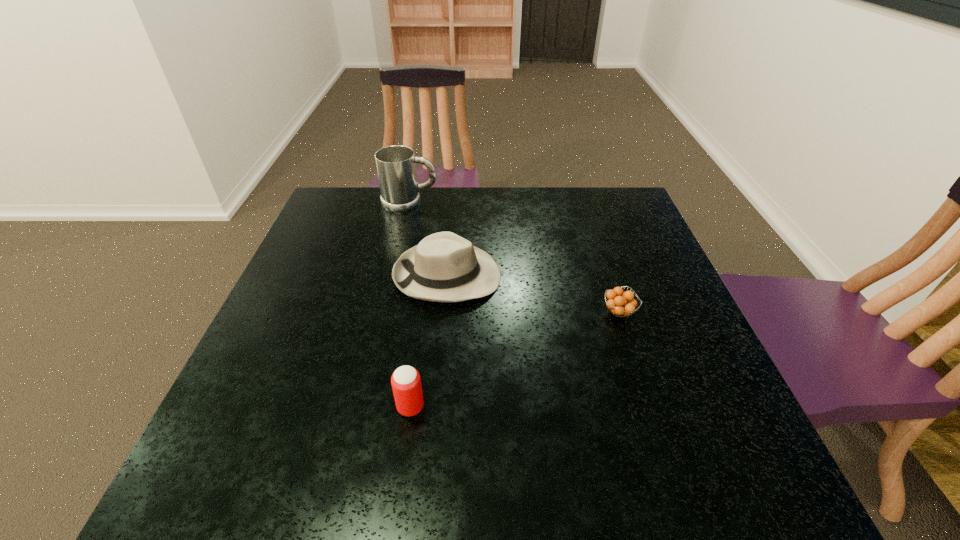
Locate an element on the screen. vacant space that's between the fedora and the orange fruit is located at coordinates (534, 294).

Locate an element on the screen. The width and height of the screenshot is (960, 540). free spot between the farthest object and the shortest object is located at coordinates (515, 258).

Locate an element on the screen. The width and height of the screenshot is (960, 540). free space between the beer can and the fedora is located at coordinates (429, 341).

Locate an element on the screen. unoccupied position between the beer can and the farthest object is located at coordinates (410, 305).

In order to click on free space between the shortest object and the nearest object in this screenshot , I will do `click(515, 360)`.

Identify the location of free space between the beer can and the mug. The image size is (960, 540). (410, 305).

The height and width of the screenshot is (540, 960). I want to click on blank region between the fedora and the beer can, so click(x=429, y=341).

Locate an element on the screen. This screenshot has height=540, width=960. object that stands as the third closest to the beer can is located at coordinates (396, 168).

Point out which object is positioned as the nearest to the mug. Please provide its 2D coordinates. Your answer should be formatted as a tuple, i.e. [(x, y)], where the tuple contains the x and y coordinates of a point satisfying the conditions above.

[(444, 267)]

The height and width of the screenshot is (540, 960). I want to click on blank area in the image that satisfies the following two spatial constraints: 1. on the side of the tallest object with the handle; 2. on the back side of the beer can, so click(364, 407).